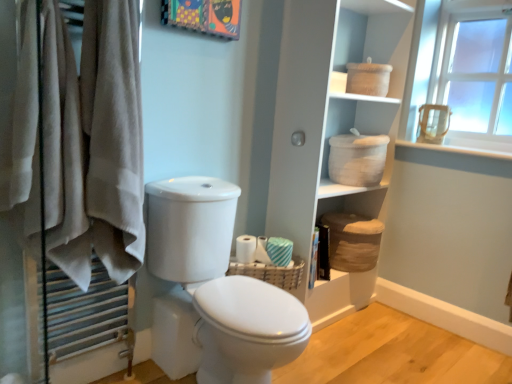
Question: Should I look upward or downward to see white glossy toilet at center?

Choices:
 (A) up
 (B) down

Answer: (B)

Question: Does white glossy toilet at center have a lesser width compared to white glossy toilet at center?

Choices:
 (A) yes
 (B) no

Answer: (B)

Question: Is the depth of white glossy toilet at center less than that of white glossy toilet at center?

Choices:
 (A) no
 (B) yes

Answer: (B)

Question: Is white glossy toilet at center positioned with its back to white glossy toilet at center?

Choices:
 (A) yes
 (B) no

Answer: (B)

Question: Is white glossy toilet at center a part of white glossy toilet at center?

Choices:
 (A) yes
 (B) no

Answer: (A)

Question: Does white glossy toilet at center appear on the right side of white glossy toilet at center?

Choices:
 (A) no
 (B) yes

Answer: (B)

Question: Is white glossy toilet at center wider than white glossy toilet at center?

Choices:
 (A) no
 (B) yes

Answer: (B)

Question: Is white glossy toilet at center smaller than brown woven basket at lower center, the second basket in the front-to-back sequence?

Choices:
 (A) no
 (B) yes

Answer: (A)

Question: From a real-world perspective, is white glossy toilet at center beneath brown woven basket at lower center, which appears as the 2th basket when viewed from the left?

Choices:
 (A) no
 (B) yes

Answer: (B)

Question: From the image's perspective, does white glossy toilet at center appear lower than brown woven basket at lower center, which appears as the 1th basket when viewed from the back?

Choices:
 (A) no
 (B) yes

Answer: (B)

Question: Is white glossy toilet at center to the right of brown woven basket at lower center, the second basket in the front-to-back sequence, from the viewer's perspective?

Choices:
 (A) no
 (B) yes

Answer: (A)

Question: Is white glossy toilet at center oriented away from brown woven basket at lower center, which appears as the 1th basket when viewed from the back?

Choices:
 (A) no
 (B) yes

Answer: (A)

Question: Does white glossy toilet at center lie behind brown woven basket at lower center, which appears as the 2th basket when viewed from the left?

Choices:
 (A) yes
 (B) no

Answer: (B)

Question: Is white striped fabric at right, acting as the 1th toilet paper starting from the right, far away from white textured toilet paper at center, placed as the 2th toilet paper when sorted from right to left?

Choices:
 (A) yes
 (B) no

Answer: (B)